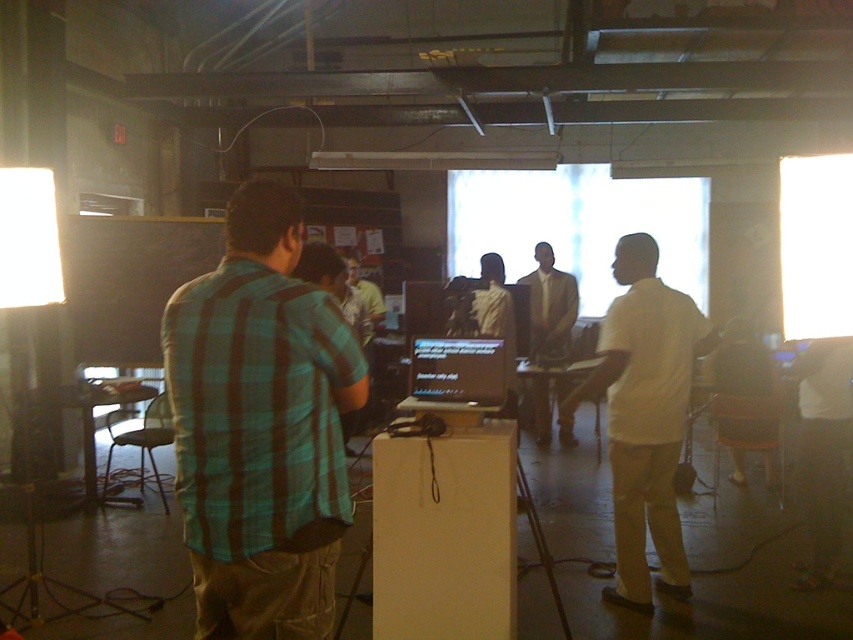
Is the position of light beige shirt at center less distant than that of matte black laptop at center?

No.

Is light beige shirt at center behind matte black laptop at center?

Yes, light beige shirt at center is further from the viewer.

Identify the location of light beige shirt at center. (549, 307).

Which is above, green plaid shirt at left or light beige shirt at center?

light beige shirt at center is above.

Locate an element on the screen. green plaid shirt at left is located at coordinates [x=260, y=428].

Identify the location of green plaid shirt at left. The image size is (853, 640). (260, 428).

From the picture: Can you confirm if green plaid shirt at left is shorter than yellow shirt at center?

No.

Is point (235, 513) more distant than point (367, 291)?

No, it is in front of (367, 291).

Identify the location of green plaid shirt at left. pyautogui.click(x=260, y=428).